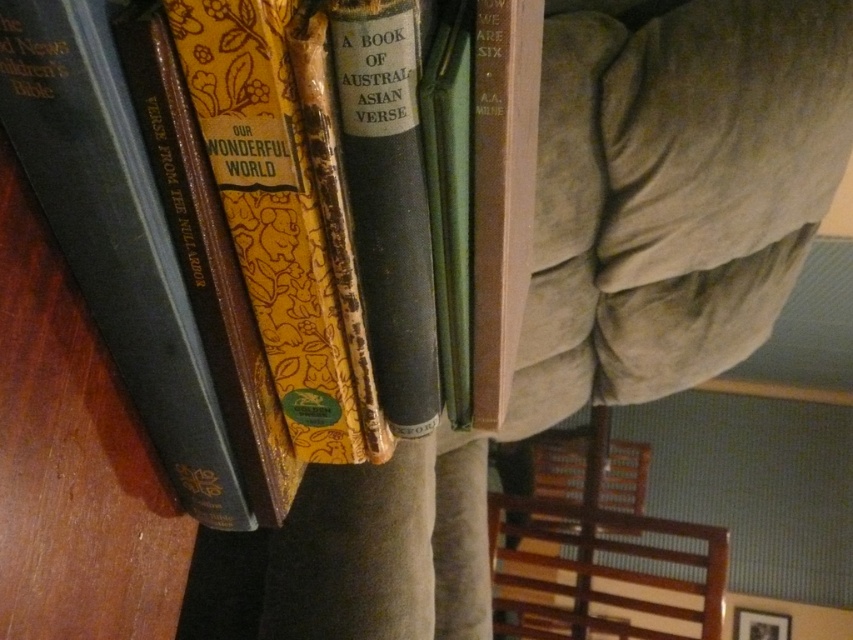
Question: Among these points, which one is nearest to the camera?

Choices:
 (A) (334, 154)
 (B) (123, 141)
 (C) (672, 524)

Answer: (B)

Question: Is hardcover book at left smaller than hardcover book at center?

Choices:
 (A) no
 (B) yes

Answer: (B)

Question: Does hardcover book at left come in front of hardcover book at center?

Choices:
 (A) no
 (B) yes

Answer: (B)

Question: Can you confirm if hardcover book at left is positioned to the right of brown wooden chair at lower right?

Choices:
 (A) no
 (B) yes

Answer: (A)

Question: Which is farther from the hardcover book at center?

Choices:
 (A) yellow paperback book at center
 (B) brown wooden chair at lower right
 (C) hardcover book at left

Answer: (B)

Question: Which of the following is the farthest from the observer?

Choices:
 (A) brown wooden chair at lower right
 (B) hardcover book at center
 (C) hardcover book at left
 (D) yellow paperback book at center

Answer: (A)